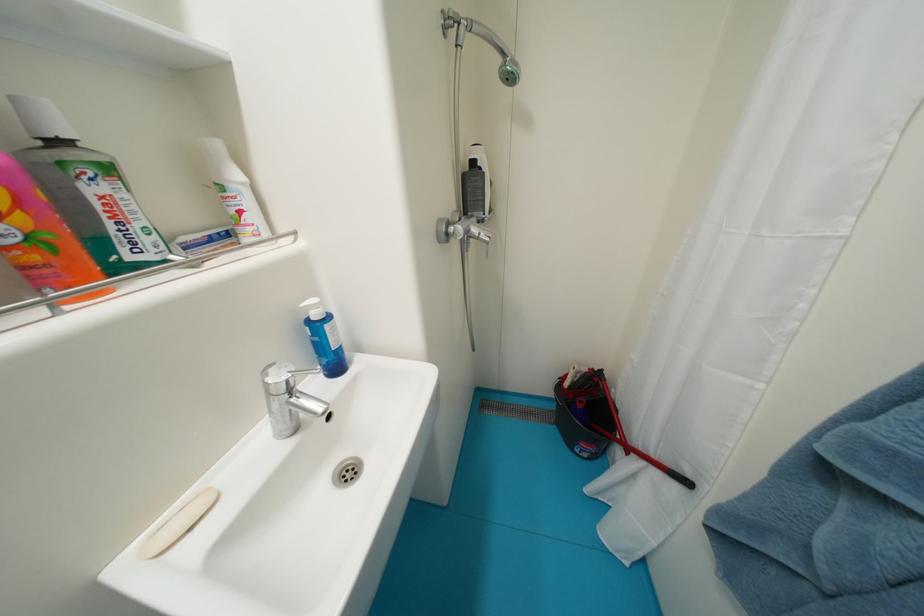
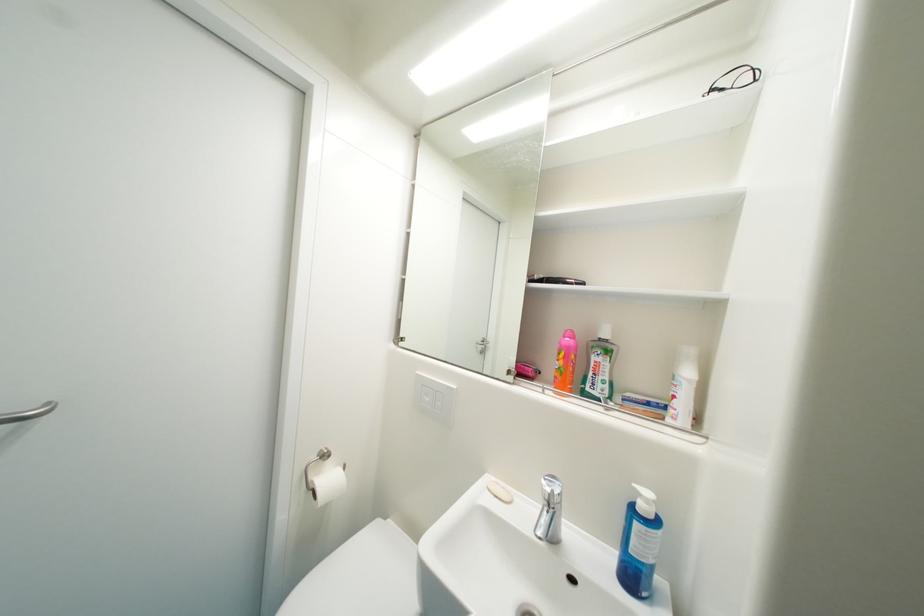
Find the pixel in the second image that matches point (199, 530) in the first image.

(503, 498)